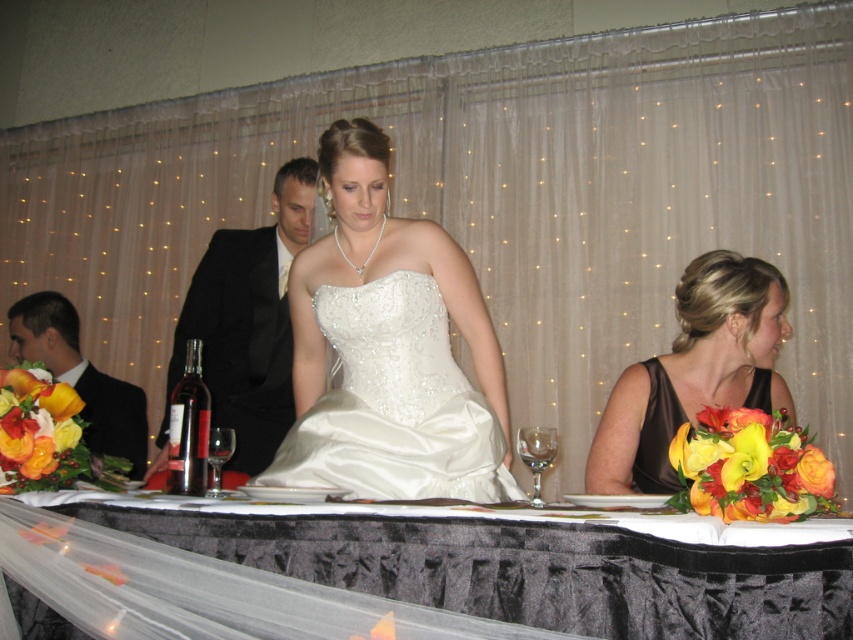
Which of these two, satin brown dress at lower right or satin black dress at lower right, stands shorter?

With less height is satin black dress at lower right.

How far apart are satin brown dress at lower right and satin black dress at lower right?

satin brown dress at lower right and satin black dress at lower right are 2.69 inches apart from each other.

Find the location of a particular element. satin brown dress at lower right is located at coordinates click(694, 371).

Locate an element on the screen. satin brown dress at lower right is located at coordinates (694, 371).

Who is more distant from viewer, (326, 161) or (660, 460)?

Point (660, 460)

Is point (422, 307) positioned in front of point (664, 419)?

Yes.

Is point (300, 480) closer to viewer compared to point (663, 452)?

Yes, point (300, 480) is closer to viewer.

Where is `satin/sequined dress at center`? satin/sequined dress at center is located at coordinates (387, 348).

Can you confirm if satin/sequined dress at center is smaller than satin brown dress at lower right?

No, satin/sequined dress at center is not smaller than satin brown dress at lower right.

Does point (469, 440) come farther from viewer compared to point (750, 356)?

No, (469, 440) is in front of (750, 356).

Looking at this image, who is more forward, (352,317) or (682,369)?

Point (352,317)

At what (x,y) coordinates should I click in order to perform the action: click on satin/sequined dress at center. Please return your answer as a coordinate pair (x, y). Looking at the image, I should click on (387, 348).